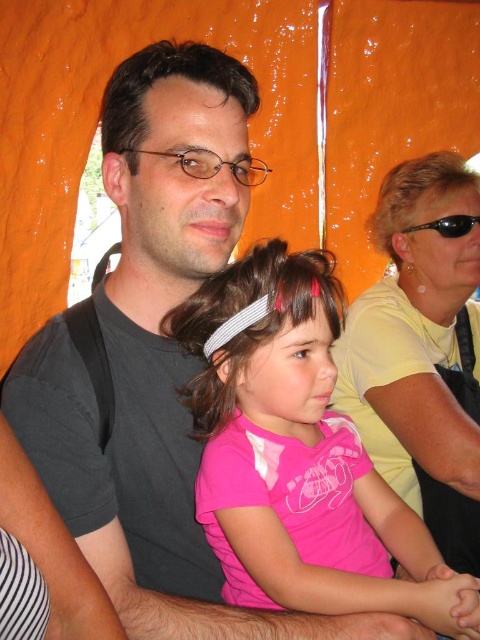
Question: Which point is farther from the camera taking this photo?

Choices:
 (A) (463, 221)
 (B) (254, 561)

Answer: (A)

Question: Is pink fabric shirt at center above black plastic goggles at upper right?

Choices:
 (A) yes
 (B) no

Answer: (B)

Question: Is pink fabric shirt at center below black plastic goggles at upper right?

Choices:
 (A) yes
 (B) no

Answer: (A)

Question: Which object is closer to the camera taking this photo?

Choices:
 (A) black plastic goggles at upper right
 (B) pink fabric shirt at center

Answer: (B)

Question: Can you confirm if pink fabric shirt at center is bigger than black plastic goggles at upper right?

Choices:
 (A) yes
 (B) no

Answer: (A)

Question: Which object is closer to the camera taking this photo?

Choices:
 (A) black plastic goggles at upper right
 (B) pink fabric shirt at center

Answer: (B)